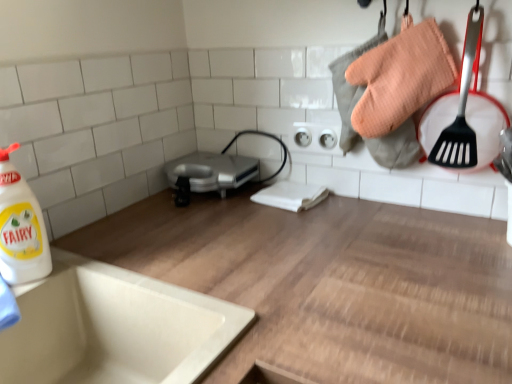
The image size is (512, 384). In order to click on free space above wooden at upper center (from a real-world perspective) in this screenshot , I will do `click(282, 238)`.